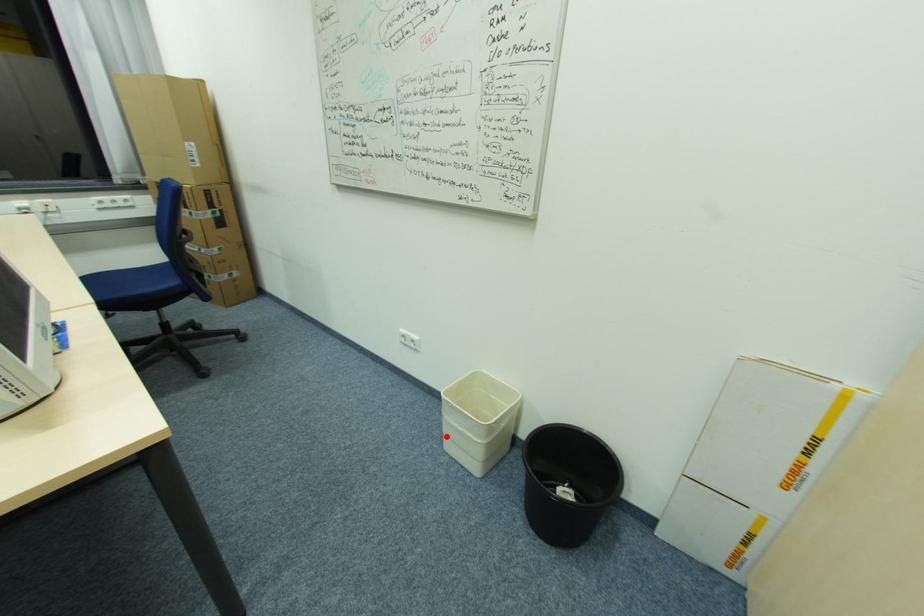
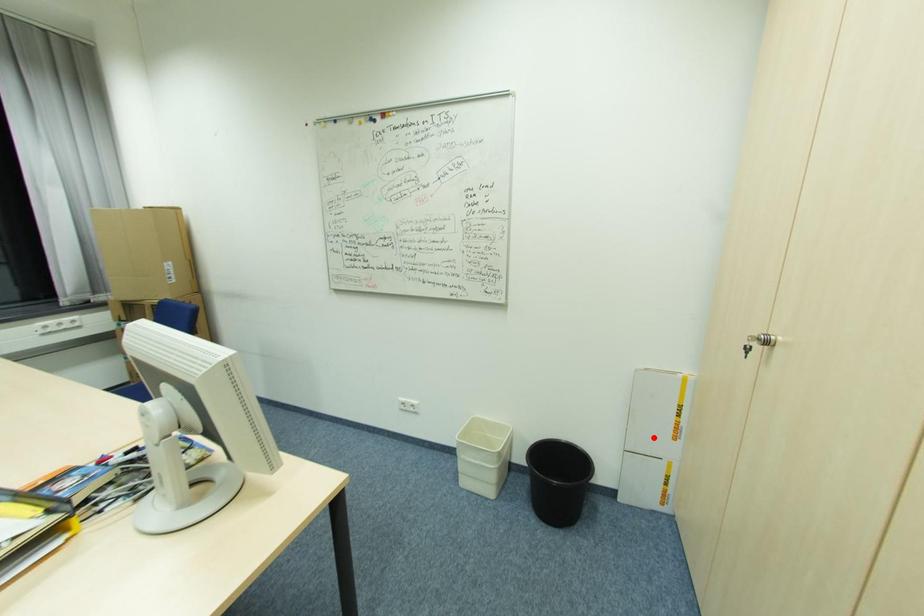
I am providing you with two images of the same scene from different viewpoints. A red point is marked on the first image and another point is marked on the second image. Is the marked point in image1 the same physical position as the marked point in image2?

No